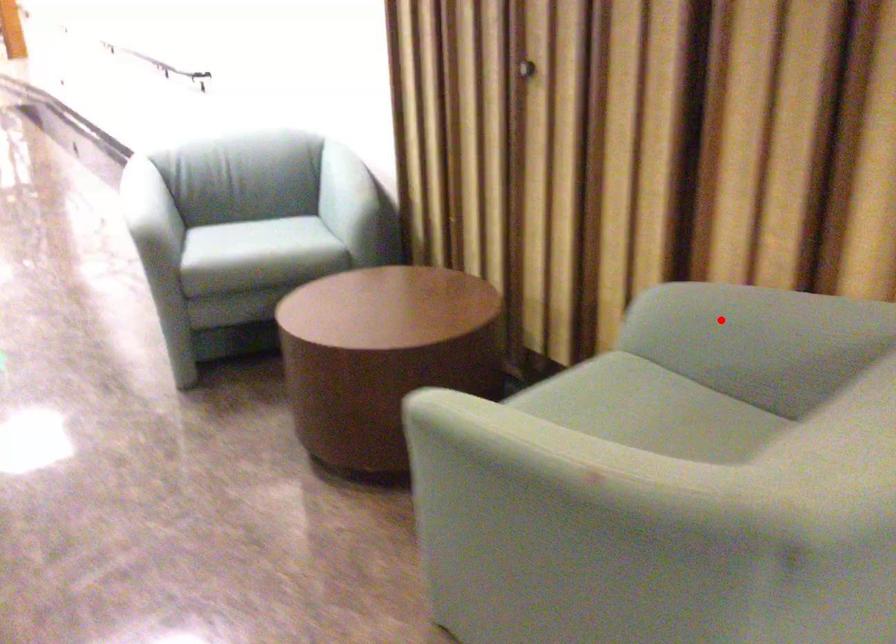
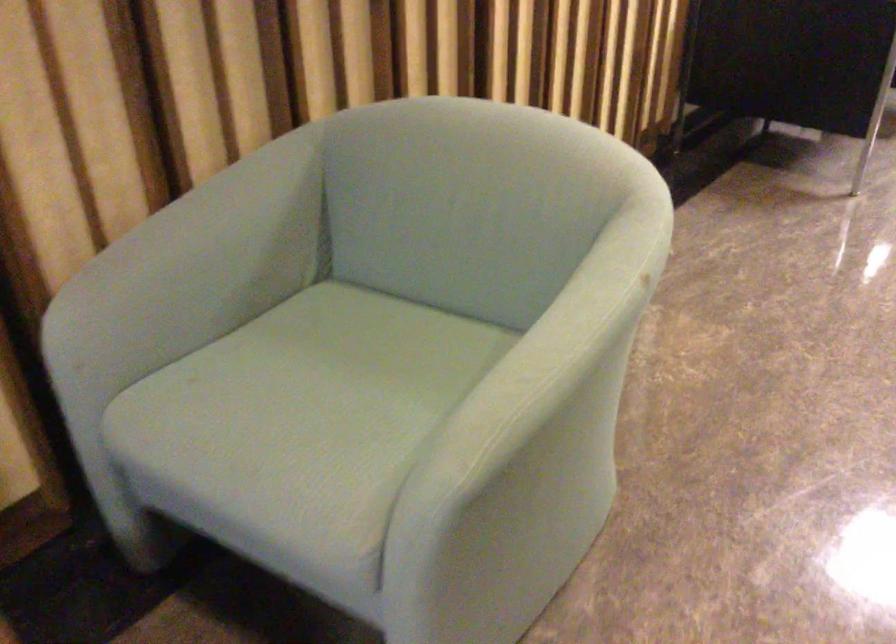
Question: I am providing you with two images of the same scene from different viewpoints. A red point is shown in image1. For the corresponding object point in image2, is it positioned nearer or farther from the camera?

Choices:
 (A) Nearer
 (B) Farther

Answer: (A)